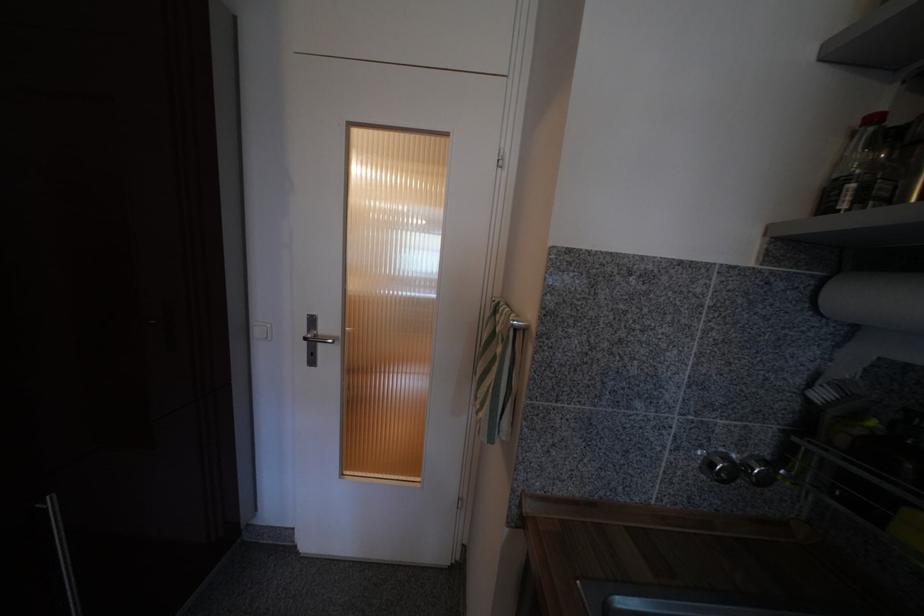
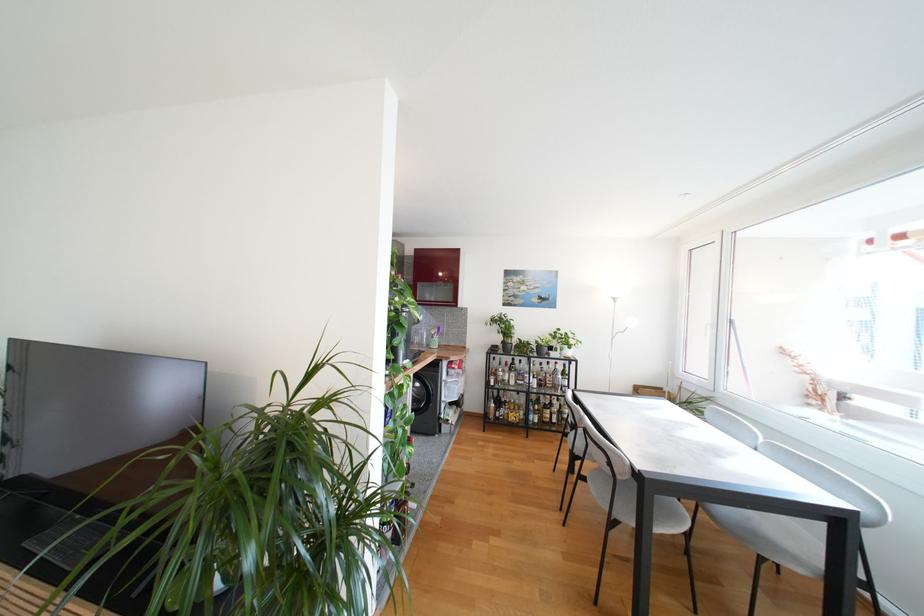
Question: I am providing you with two images of the same scene from different viewpoints. After the viewpoint changes to image2, which objects are now occluded?

Choices:
 (A) glass bottle
 (B) paper towel roll
 (C) grey chair sitting surface
 (D) large wooden board

Answer: (B)